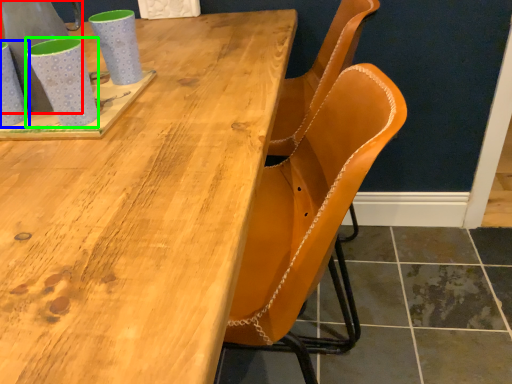
Question: Which object is positioned farthest from gray (highlighted by a red box)? Select from mug (highlighted by a blue box) and mug (highlighted by a green box).

Choices:
 (A) mug
 (B) mug

Answer: (B)